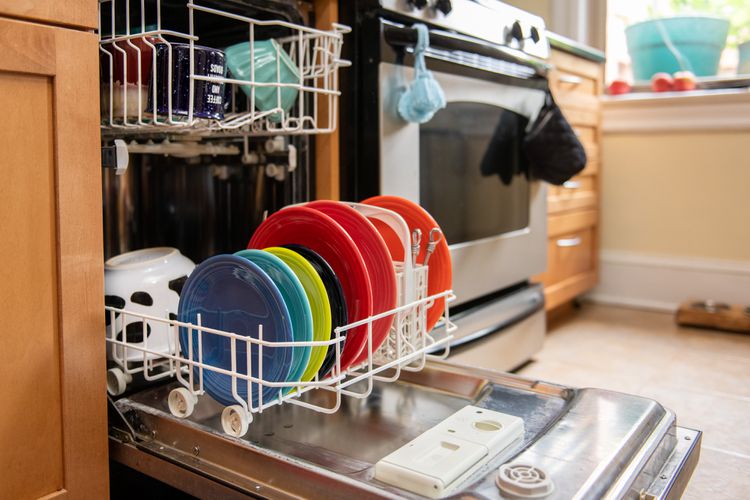
At what (x,y) coordinates should I click in order to perform the action: click on dishes in dishwasher. Please return your answer as a coordinate pair (x, y). The image size is (750, 500). Looking at the image, I should click on pos(230,290), pos(276,272), pos(303,276), pos(320,274), pos(344,272), pos(374,249), pos(418,224).